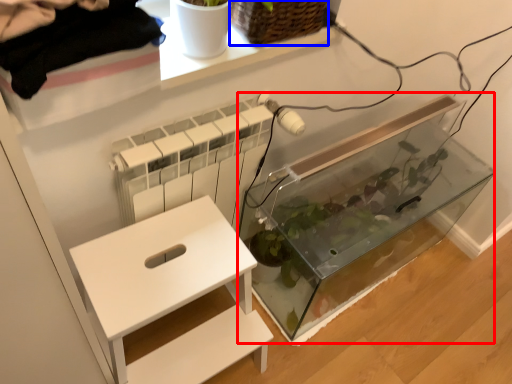
Question: Which object appears closest to the camera in this image, glass box (highlighted by a red box) or basket (highlighted by a blue box)?

Choices:
 (A) glass box
 (B) basket

Answer: (B)